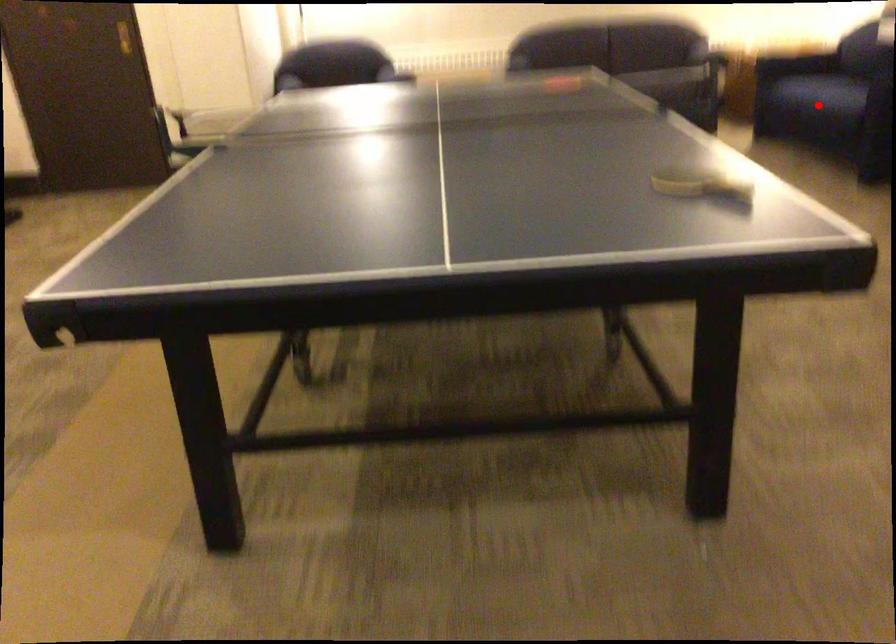
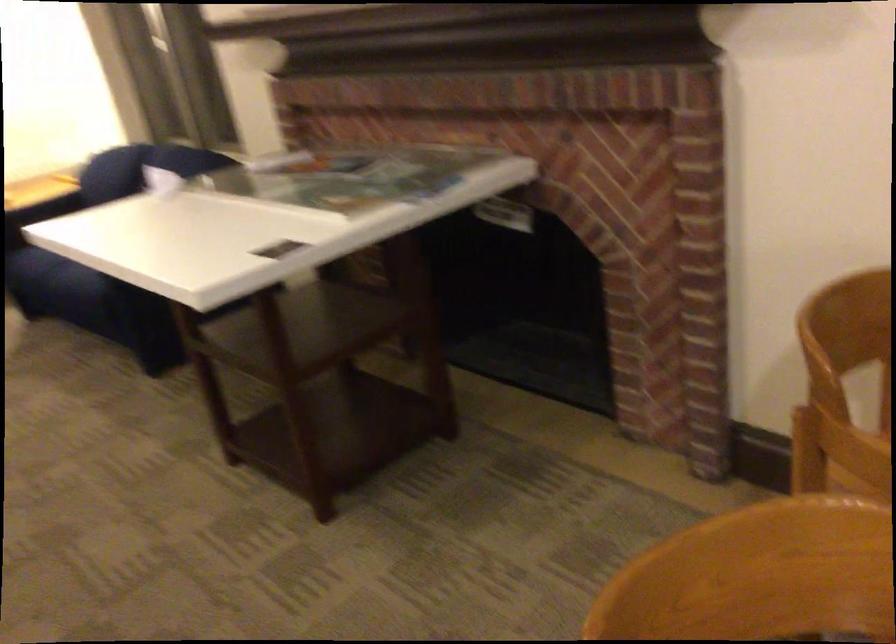
Question: I am providing you with two images of the same scene from different viewpoints. A red point is marked on the first image. Can you still see the location of the red point in image 2?

Choices:
 (A) Yes
 (B) No

Answer: (B)